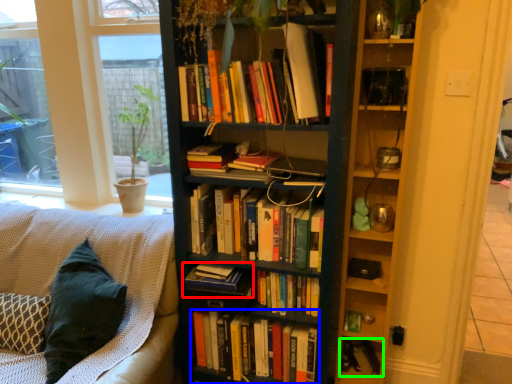
Question: Which object is positioned closest to book (highlighted by a red box)? Select from book (highlighted by a blue box) and book (highlighted by a green box).

Choices:
 (A) book
 (B) book

Answer: (A)